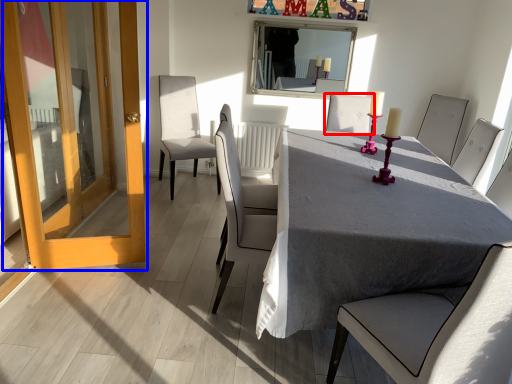
Question: Which object appears closest to the camera in this image, chair (highlighted by a red box) or door (highlighted by a blue box)?

Choices:
 (A) chair
 (B) door

Answer: (B)